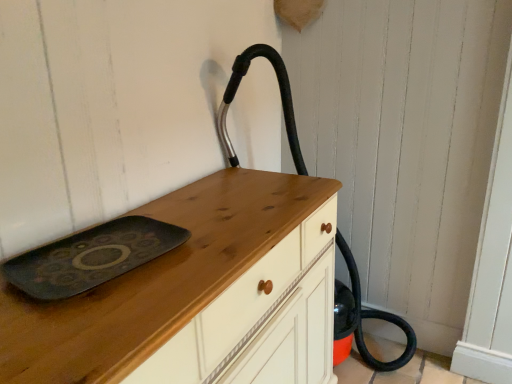
Image resolution: width=512 pixels, height=384 pixels. In order to click on free point behind matte black tray at center in this screenshot , I will do `click(163, 212)`.